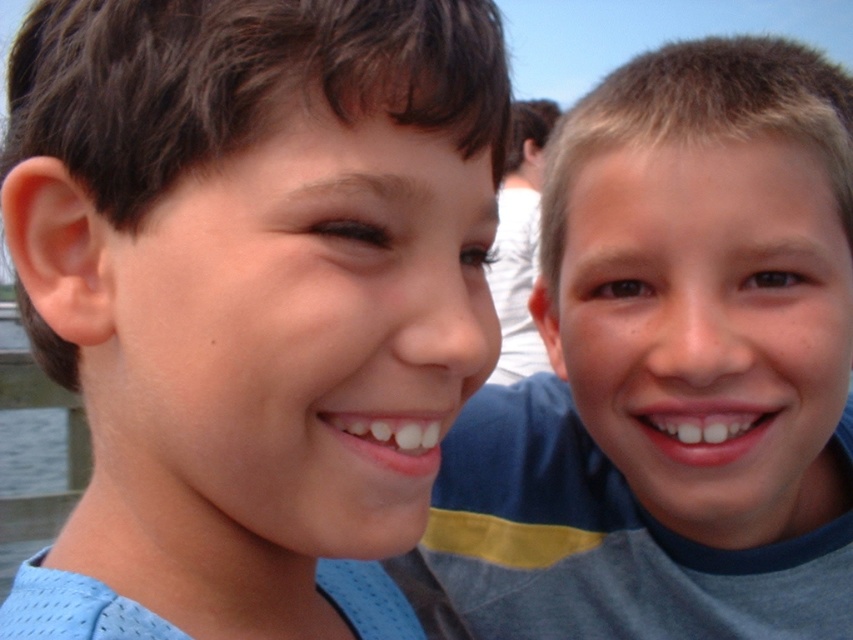
In the scene shown: You are a photographer standing 1 meter away from the blue mesh shirt at left in the image. Can you confirm if you are within the minimum focusing distance required to capture the shirt clearly?

The blue mesh shirt at left is 41.16 centimeters away from the viewer. Since you are standing 1 meter away, which is farther than the shirt, you are outside the minimum focusing distance and may not capture it clearly.

You are taking a photo of two boys. The blue mesh shirt at left is represented by point (250, 298). Where should you focus your camera to ensure the blue mesh shirt at left is in sharp focus?

To ensure the blue mesh shirt at left is in sharp focus, focus your camera on point (250, 298).

You are a photographer trying to capture the boys in the image. Which boy is positioned higher in the frame, the one wearing the blue mesh shirt at left or the smooth blue shirt at right?

The blue mesh shirt at left is located above the smooth blue shirt at right, so the boy wearing the blue mesh shirt at left is positioned higher in the frame.